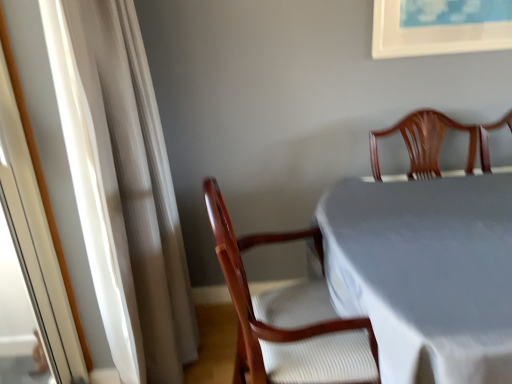
Where is `white sheer curtain at left`? Image resolution: width=512 pixels, height=384 pixels. white sheer curtain at left is located at coordinates (122, 186).

The width and height of the screenshot is (512, 384). In order to click on white cloth-covered table at center in this screenshot , I will do [425, 273].

Locate an element on the screen. This screenshot has width=512, height=384. chair positioned vertically above the white cloth-covered table at center (from a real-world perspective) is located at coordinates click(290, 316).

Is the surface of white cloth-covered table at center in direct contact with wooden chair at center?

There is a gap between white cloth-covered table at center and wooden chair at center.

From a real-world perspective, is white cloth-covered table at center below wooden chair at center?

Indeed, from a real-world perspective, white cloth-covered table at center is positioned beneath wooden chair at center.

Which object is further away from the camera, white cloth-covered table at center or white sheer curtain at left?

white sheer curtain at left is more distant.

Image resolution: width=512 pixels, height=384 pixels. In order to click on table in front of the white sheer curtain at left in this screenshot , I will do `click(425, 273)`.

Which is less distant, (x=431, y=325) or (x=102, y=36)?

Point (x=431, y=325) appears to be closer to the viewer than point (x=102, y=36).

Is there a large distance between white cloth-covered table at center and white sheer curtain at left?

Actually, white cloth-covered table at center and white sheer curtain at left are a little close together.

Is the surface of white sheer curtain at left in direct contact with white cloth-covered table at center?

No.

Is white cloth-covered table at center a part of white sheer curtain at left?

Definitely not — white cloth-covered table at center is not inside white sheer curtain at left.

Where is `table that appears below the white sheer curtain at left (from the image's perspective)`? The image size is (512, 384). table that appears below the white sheer curtain at left (from the image's perspective) is located at coordinates (425, 273).

Where is `chair that appears behind the white sheer curtain at left`? The height and width of the screenshot is (384, 512). chair that appears behind the white sheer curtain at left is located at coordinates (290, 316).

In the image, is wooden chair at center positioned in front of or behind white sheer curtain at left?

wooden chair at center is positioned farther from the viewer than white sheer curtain at left.

Considering the sizes of wooden chair at center and white sheer curtain at left in the image, is wooden chair at center wider or thinner than white sheer curtain at left?

wooden chair at center is wider than white sheer curtain at left.

Would you say wooden chair at center is inside or outside white sheer curtain at left?

The correct answer is: outside.

How many degrees apart are the facing directions of white sheer curtain at left and wooden chair at center?

They differ by 1.7 degrees in their facing directions.

From the image's perspective, is white sheer curtain at left above wooden chair at center?

Correct, white sheer curtain at left appears higher than wooden chair at center in the image.

From the picture: Is white sheer curtain at left next to wooden chair at center and touching it?

No, white sheer curtain at left is not in contact with wooden chair at center.

From a real-world perspective, is white sheer curtain at left physically below wooden chair at center?

Incorrect, from a real-world perspective, white sheer curtain at left is higher than wooden chair at center.

Can we say wooden chair at center lies outside white cloth-covered table at center?

No, wooden chair at center is inside or overlapping with white cloth-covered table at center.

Does wooden chair at center have a lesser width compared to white cloth-covered table at center?

Yes, wooden chair at center is thinner than white cloth-covered table at center.

Between wooden chair at center and white cloth-covered table at center, which one has larger size?

Bigger between the two is white cloth-covered table at center.

From a real-world perspective, is wooden chair at center positioned above or below white cloth-covered table at center?

In terms of real-world spatial position, wooden chair at center is above white cloth-covered table at center.

Image resolution: width=512 pixels, height=384 pixels. I want to click on table lying below the wooden chair at center (from the image's perspective), so click(425, 273).

Identify the location of curtain located on the left of white cloth-covered table at center. (122, 186).

When comparing their distances from wooden chair at center, does white cloth-covered table at center or white sheer curtain at left seem further?

white sheer curtain at left.

Looking at the image, which one is located closer to white cloth-covered table at center, wooden chair at center or white sheer curtain at left?

wooden chair at center is closer to white cloth-covered table at center.

Based on their spatial positions, is white sheer curtain at left or white cloth-covered table at center closer to wooden chair at center?

Based on the image, white cloth-covered table at center appears to be nearer to wooden chair at center.

Based on their spatial positions, is white cloth-covered table at center or wooden chair at center closer to white sheer curtain at left?

The object closer to white sheer curtain at left is wooden chair at center.

Looking at the image, which one is located further to white sheer curtain at left, wooden chair at center or white cloth-covered table at center?

white cloth-covered table at center.

From the image, which object appears to be nearer to white cloth-covered table at center, white sheer curtain at left or wooden chair at center?

wooden chair at center lies closer to white cloth-covered table at center than the other object.

Where is `chair between white sheer curtain at left and white cloth-covered table at center from left to right`? The height and width of the screenshot is (384, 512). chair between white sheer curtain at left and white cloth-covered table at center from left to right is located at coordinates (290, 316).